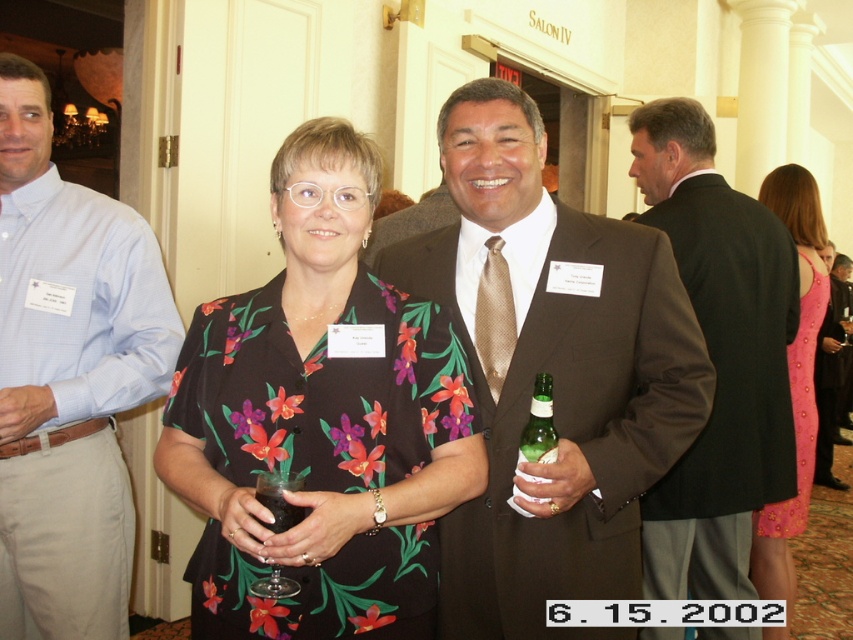
Is light blue checkered shirt at left shorter than pink satin dress at right?

Yes.

Is light blue checkered shirt at left closer to camera compared to pink satin dress at right?

That is True.

This screenshot has width=853, height=640. What are the coordinates of `light blue checkered shirt at left` in the screenshot? It's located at (68, 378).

Does floral print blouse at center have a larger size compared to green glass bottle at center?

Indeed, floral print blouse at center has a larger size compared to green glass bottle at center.

Which is more to the left, floral print blouse at center or green glass bottle at center?

floral print blouse at center is more to the left.

Between point (370, 166) and point (556, 456), which one is positioned behind?

The point (556, 456) is more distant.

The width and height of the screenshot is (853, 640). In order to click on floral print blouse at center in this screenshot , I will do `click(320, 420)`.

Is the position of floral print blouse at center less distant than that of black suit at right?

That is True.

Can you confirm if floral print blouse at center is positioned to the right of black suit at right?

In fact, floral print blouse at center is to the left of black suit at right.

Is point (376, 500) positioned behind point (733, 528)?

No, it is in front of (733, 528).

Where is `floral print blouse at center`? This screenshot has height=640, width=853. floral print blouse at center is located at coordinates (320, 420).